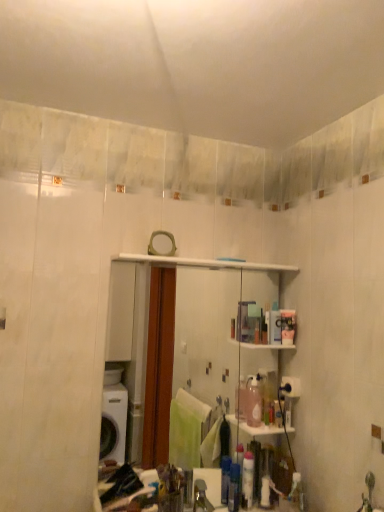
Question: From the image's perspective, is metallic silver faucet at lower center under translucent plastic container at upper right?

Choices:
 (A) no
 (B) yes

Answer: (B)

Question: Can you confirm if metallic silver faucet at lower center is thinner than translucent plastic container at upper right?

Choices:
 (A) no
 (B) yes

Answer: (A)

Question: Does metallic silver faucet at lower center lie behind translucent plastic container at upper right?

Choices:
 (A) yes
 (B) no

Answer: (B)

Question: Can we say metallic silver faucet at lower center lies outside translucent plastic container at upper right?

Choices:
 (A) yes
 (B) no

Answer: (A)

Question: Would you say metallic silver faucet at lower center is a long distance from translucent plastic container at upper right?

Choices:
 (A) yes
 (B) no

Answer: (B)

Question: Does metallic silver faucet at lower center have a greater width compared to translucent plastic container at upper right?

Choices:
 (A) no
 (B) yes

Answer: (B)

Question: Is metallic silver faucet at lower center at the back of clear glass mirror at center?

Choices:
 (A) no
 (B) yes

Answer: (B)

Question: Considering the relative sizes of clear glass mirror at center and metallic silver faucet at lower center in the image provided, is clear glass mirror at center shorter than metallic silver faucet at lower center?

Choices:
 (A) yes
 (B) no

Answer: (B)

Question: From a real-world perspective, does clear glass mirror at center stand above metallic silver faucet at lower center?

Choices:
 (A) no
 (B) yes

Answer: (B)

Question: From the image's perspective, is clear glass mirror at center on metallic silver faucet at lower center?

Choices:
 (A) yes
 (B) no

Answer: (A)

Question: Could you tell me if clear glass mirror at center is turned towards metallic silver faucet at lower center?

Choices:
 (A) no
 (B) yes

Answer: (B)

Question: Is the surface of clear glass mirror at center in direct contact with metallic silver faucet at lower center?

Choices:
 (A) yes
 (B) no

Answer: (B)

Question: Is metallic silver faucet at lower center to the right of clear glass mirror at center from the viewer's perspective?

Choices:
 (A) yes
 (B) no

Answer: (A)